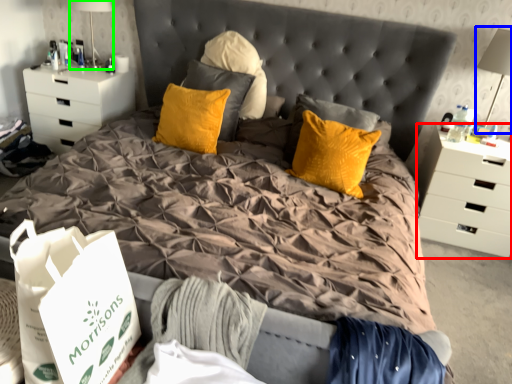
Question: Estimate the real-world distances between objects in this image. Which object is closer to chest of drawers (highlighted by a red box), table lamp (highlighted by a blue box) or table lamp (highlighted by a green box)?

Choices:
 (A) table lamp
 (B) table lamp

Answer: (A)